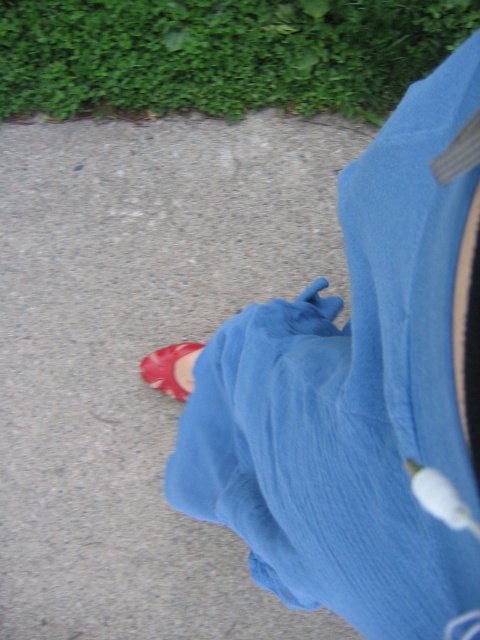
Question: Is matte blue pants at lower center smaller than shiny red shoe at lower left?

Choices:
 (A) no
 (B) yes

Answer: (A)

Question: Among these objects, which one is farthest from the camera?

Choices:
 (A) gray concrete pavement at center
 (B) matte blue pants at lower center

Answer: (A)

Question: Is gray concrete pavement at center bigger than matte blue pants at lower center?

Choices:
 (A) yes
 (B) no

Answer: (A)

Question: Which point is closer to the camera?

Choices:
 (A) (440, 298)
 (B) (180, 356)
 (C) (20, 440)

Answer: (A)

Question: Among these points, which one is nearest to the camera?

Choices:
 (A) [x=202, y=344]
 (B) [x=38, y=612]

Answer: (A)

Question: Is matte blue pants at lower center bigger than shiny red shoe at lower left?

Choices:
 (A) yes
 (B) no

Answer: (A)